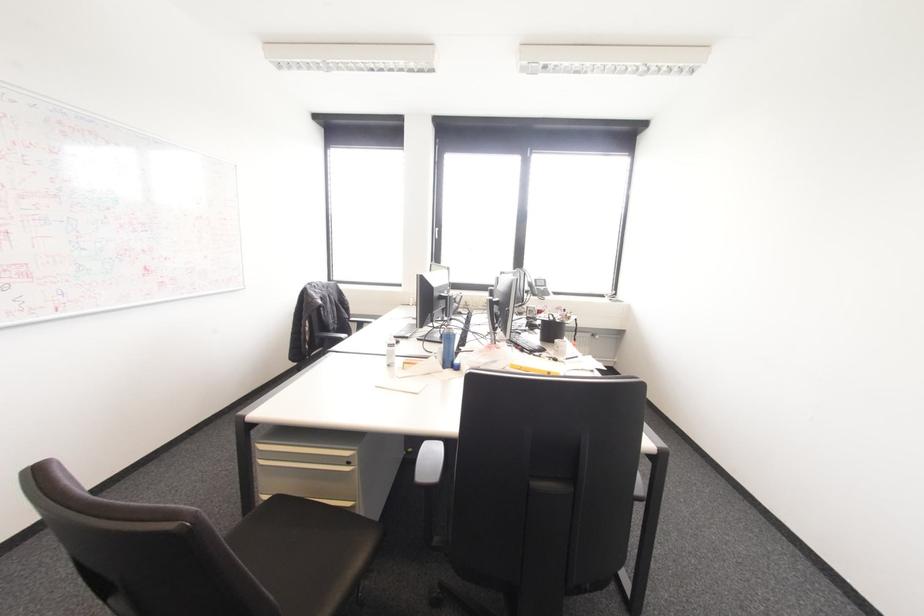
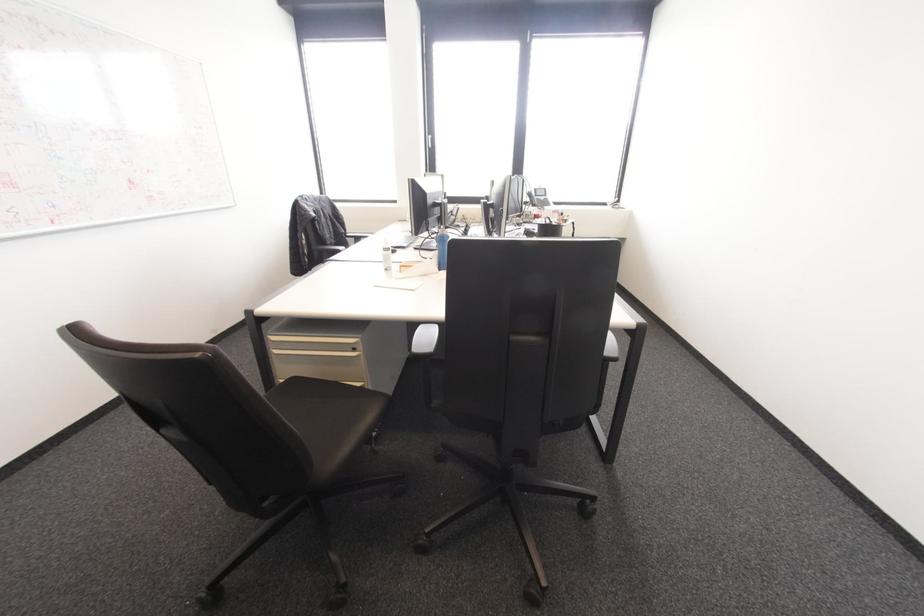
Where in the second image is the point corresponding to point (339, 339) from the first image?

(337, 251)